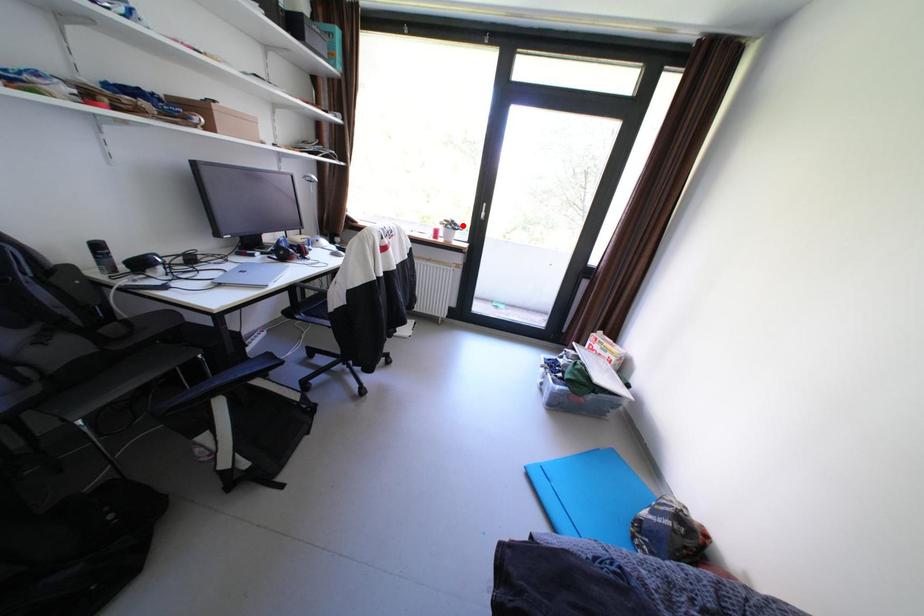
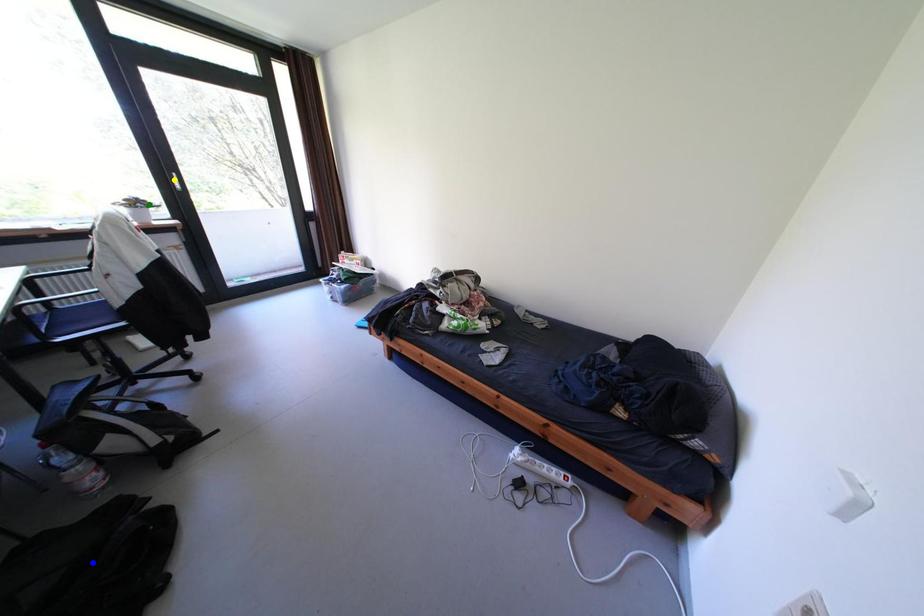
Question: I am providing you with two images of the same scene from different viewpoints. A red point is marked on the first image. You are given multiple points on the second image. In image 2, which mark is for the same physical point as the one in image 1?

Choices:
 (A) green point
 (B) yellow point
 (C) blue point

Answer: (A)